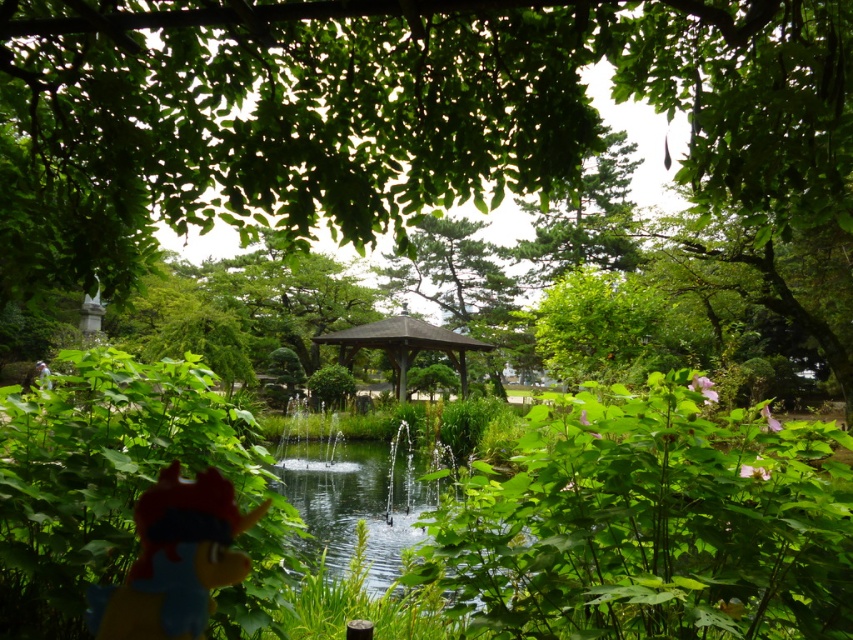
Is smooth gray gazebo at center to the right of brown wooden gazebo at center from the viewer's perspective?

Yes, smooth gray gazebo at center is to the right of brown wooden gazebo at center.

Is the position of smooth gray gazebo at center less distant than that of brown wooden gazebo at center?

Yes, smooth gray gazebo at center is in front of brown wooden gazebo at center.

This screenshot has height=640, width=853. Describe the element at coordinates (459, 280) in the screenshot. I see `smooth gray gazebo at center` at that location.

At what (x,y) coordinates should I click in order to perform the action: click on smooth gray gazebo at center. Please return your answer as a coordinate pair (x, y). The height and width of the screenshot is (640, 853). Looking at the image, I should click on [x=459, y=280].

Can you confirm if plush red toy at lower left is wider than brown wooden gazebo at center?

In fact, plush red toy at lower left might be narrower than brown wooden gazebo at center.

Between point (202, 499) and point (436, 339), which one is positioned in front?

Point (202, 499) is in front.

This screenshot has width=853, height=640. Find the location of `plush red toy at lower left`. plush red toy at lower left is located at coordinates (175, 560).

Identify the location of plush red toy at lower left. This screenshot has height=640, width=853. (175, 560).

Does plush red toy at lower left have a greater height compared to smooth gray gazebo at center?

No.

Locate an element on the screen. plush red toy at lower left is located at coordinates point(175,560).